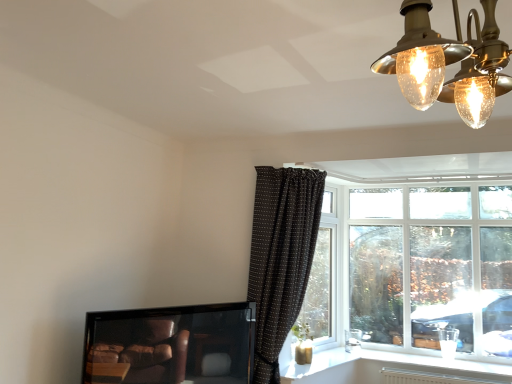
Find the location of a particular element. gold textured chandelier at upper right is located at coordinates 422,55.

What do you see at coordinates (422, 55) in the screenshot? I see `gold textured chandelier at upper right` at bounding box center [422, 55].

This screenshot has width=512, height=384. Identify the location of brown dotted fabric curtain at upper center. (281, 257).

Measure the distance between point [446,278] and camera.

They are 4.03 meters apart.

At what (x,y) coordinates should I click in order to perform the action: click on gold textured chandelier at upper right. Please return your answer as a coordinate pair (x, y). The height and width of the screenshot is (384, 512). Looking at the image, I should click on (422, 55).

Which point is more forward, (456, 361) or (328, 302)?

The point (456, 361) is closer to the camera.

Does white plastic window sill at lower right turn towards white plastic window at upper right?

No, white plastic window sill at lower right is not facing towards white plastic window at upper right.

This screenshot has height=384, width=512. What are the coordinates of `window sill located in front of the white plastic window at upper right` in the screenshot? It's located at (391, 369).

Can you confirm if matte black tv at lower left is positioned to the right of white plastic window sill at lower right?

In fact, matte black tv at lower left is to the left of white plastic window sill at lower right.

From a real-world perspective, between matte black tv at lower left and white plastic window sill at lower right, who is vertically higher?

matte black tv at lower left, from a real-world perspective.

Does matte black tv at lower left have a smaller size compared to white plastic window sill at lower right?

No, matte black tv at lower left is not smaller than white plastic window sill at lower right.

Looking at this image, does gold textured chandelier at upper right have a greater width compared to white plastic window at upper right?

Indeed, gold textured chandelier at upper right has a greater width compared to white plastic window at upper right.

Based on the photo, from a real-world perspective, is gold textured chandelier at upper right on white plastic window at upper right?

Correct, in the physical world, gold textured chandelier at upper right is higher than white plastic window at upper right.

Is gold textured chandelier at upper right outside of white plastic window at upper right?

Absolutely, gold textured chandelier at upper right is external to white plastic window at upper right.

From the image's perspective, is gold textured chandelier at upper right above white plastic window at upper right?

Indeed, from the image's perspective, gold textured chandelier at upper right is shown above white plastic window at upper right.

Which object is wider, matte black tv at lower left or white plastic window at upper right?

Wider between the two is matte black tv at lower left.

The width and height of the screenshot is (512, 384). What are the coordinates of `television on the left of white plastic window at upper right` in the screenshot? It's located at (170, 345).

Does matte black tv at lower left come in front of white plastic window at upper right?

Yes, the depth of matte black tv at lower left is less than that of white plastic window at upper right.

Considering the relative sizes of white plastic window sill at lower right and gold textured chandelier at upper right in the image provided, is white plastic window sill at lower right thinner than gold textured chandelier at upper right?

Incorrect, the width of white plastic window sill at lower right is not less than that of gold textured chandelier at upper right.

Would you say white plastic window sill at lower right is to the left or to the right of gold textured chandelier at upper right in the picture?

white plastic window sill at lower right is to the right of gold textured chandelier at upper right.

Who is smaller, white plastic window sill at lower right or gold textured chandelier at upper right?

With smaller size is white plastic window sill at lower right.

Where is `window sill that is below the gold textured chandelier at upper right (from the image's perspective)`? The width and height of the screenshot is (512, 384). window sill that is below the gold textured chandelier at upper right (from the image's perspective) is located at coordinates (391, 369).

The image size is (512, 384). I want to click on curtain in front of the white plastic window sill at lower right, so click(281, 257).

Looking at this image, does white plastic window sill at lower right turn towards brown dotted fabric curtain at upper center?

No, white plastic window sill at lower right is not oriented towards brown dotted fabric curtain at upper center.

How many degrees apart are the facing directions of white plastic window sill at lower right and brown dotted fabric curtain at upper center?

76.9 degrees.

Does white plastic window sill at lower right have a lesser width compared to brown dotted fabric curtain at upper center?

Yes, white plastic window sill at lower right is thinner than brown dotted fabric curtain at upper center.

From the image's perspective, which one is positioned higher, white plastic window at upper right or matte black tv at lower left?

white plastic window at upper right.

Who is taller, white plastic window at upper right or matte black tv at lower left?

With more height is white plastic window at upper right.

From a real-world perspective, which object stands above the other?

white plastic window at upper right.

Can you confirm if white plastic window at upper right is positioned to the right of matte black tv at lower left?

Yes, white plastic window at upper right is to the right of matte black tv at lower left.

Locate an element on the screen. window behind the white plastic window sill at lower right is located at coordinates (411, 265).

The image size is (512, 384). There is a white plastic window sill at lower right. Identify the location of television above it (from a real-world perspective). (170, 345).

Based on their spatial positions, is gold textured chandelier at upper right or white plastic window at upper right closer to matte black tv at lower left?

white plastic window at upper right is positioned closer to the anchor matte black tv at lower left.

Looking at the image, which one is located further to white plastic window sill at lower right, brown dotted fabric curtain at upper center or white plastic window at upper right?

The object further to white plastic window sill at lower right is brown dotted fabric curtain at upper center.

Estimate the real-world distances between objects in this image. Which object is closer to white plastic window at upper right, gold textured chandelier at upper right or white plastic window sill at lower right?

white plastic window sill at lower right is closer to white plastic window at upper right.

Which object lies nearer to the anchor point matte black tv at lower left, white plastic window sill at lower right or white plastic window at upper right?

Based on the image, white plastic window sill at lower right appears to be nearer to matte black tv at lower left.

Considering their positions, is gold textured chandelier at upper right positioned further to white plastic window at upper right than matte black tv at lower left?

Among the two, gold textured chandelier at upper right is located further to white plastic window at upper right.

Based on their spatial positions, is white plastic window sill at lower right or matte black tv at lower left further from white plastic window at upper right?

Based on the image, matte black tv at lower left appears to be further to white plastic window at upper right.

Considering their positions, is matte black tv at lower left positioned further to brown dotted fabric curtain at upper center than white plastic window at upper right?

white plastic window at upper right is further to brown dotted fabric curtain at upper center.

Looking at the image, which one is located further to brown dotted fabric curtain at upper center, white plastic window at upper right or white plastic window sill at lower right?

white plastic window at upper right is further to brown dotted fabric curtain at upper center.

Where is `window sill between matte black tv at lower left and white plastic window at upper right`? This screenshot has height=384, width=512. window sill between matte black tv at lower left and white plastic window at upper right is located at coordinates (391, 369).

Locate an element on the screen. This screenshot has width=512, height=384. curtain located between gold textured chandelier at upper right and white plastic window at upper right in the depth direction is located at coordinates (281, 257).

This screenshot has width=512, height=384. Find the location of `television located between gold textured chandelier at upper right and brown dotted fabric curtain at upper center in the depth direction`. television located between gold textured chandelier at upper right and brown dotted fabric curtain at upper center in the depth direction is located at coordinates pos(170,345).

Find the location of a particular element. The width and height of the screenshot is (512, 384). television positioned between gold textured chandelier at upper right and white plastic window sill at lower right from near to far is located at coordinates (170, 345).